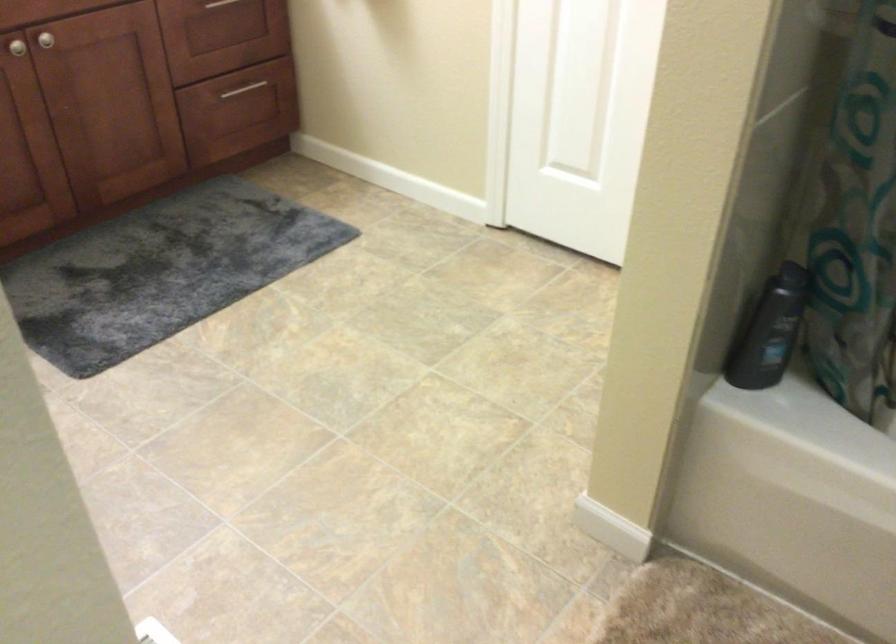
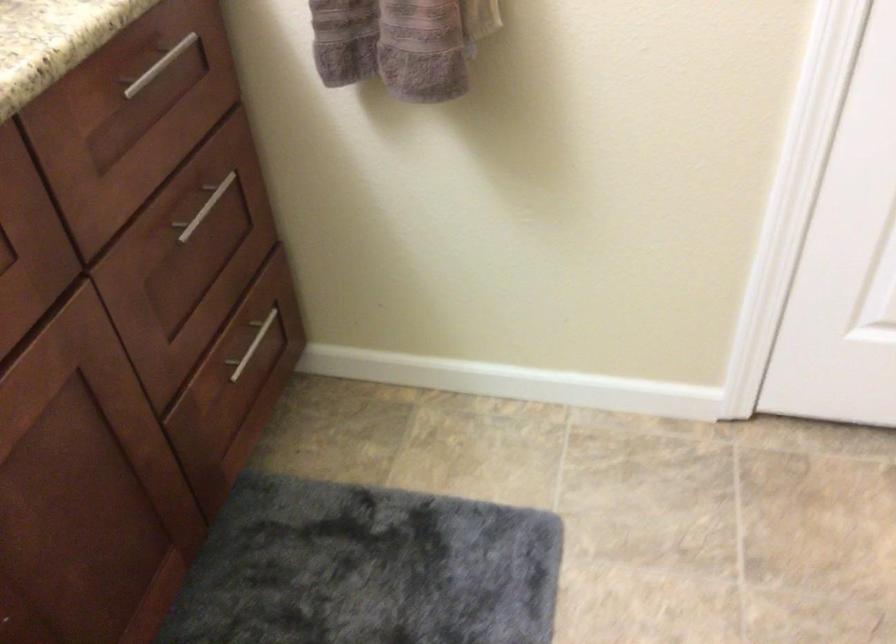
The point at (252, 91) is marked in the first image. Where is the corresponding point in the second image?

(252, 345)